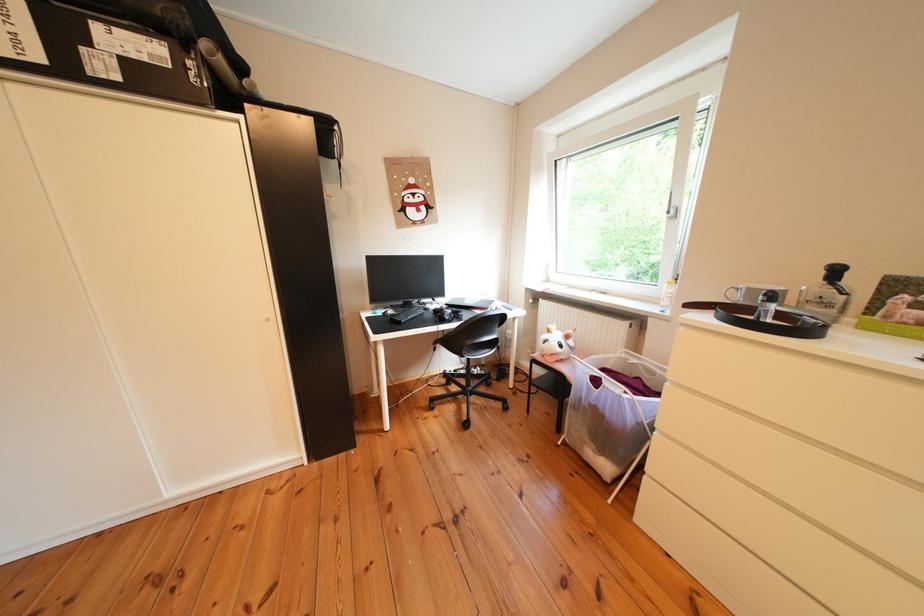
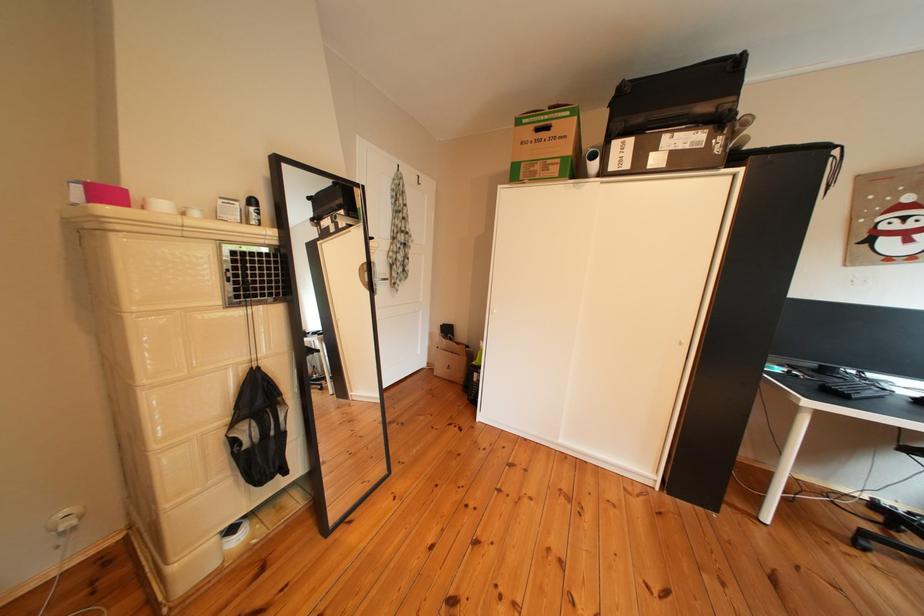
Locate, in the second image, the point that corresponds to the point at 131,83 in the first image.

(676, 169)